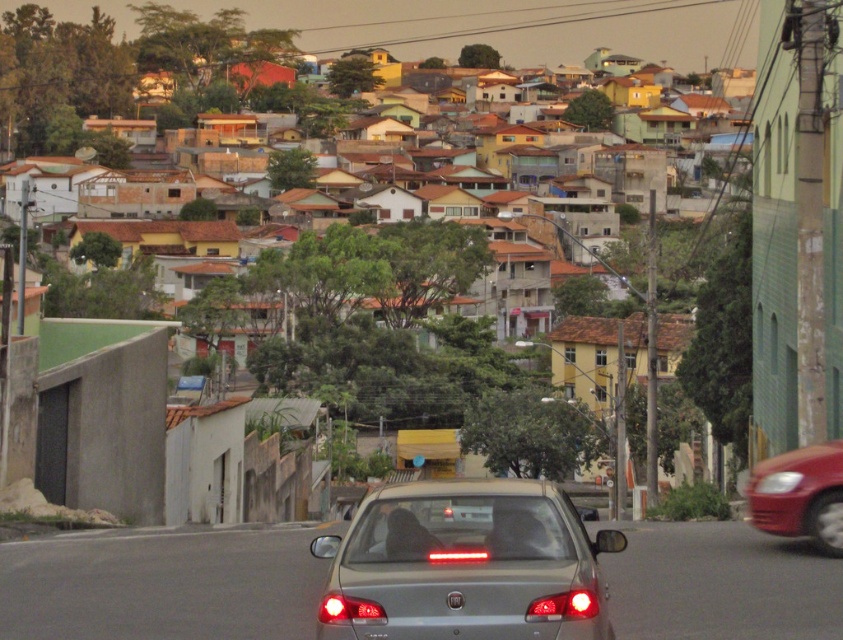
In the scene shown: You are standing at the point with coordinates point [772,461] and want to walk to the point with coordinates point [74,58]. Which direction should you face to move towards your destination?

Answer: You should face downward because point [74,58] is behind point [772,461].

You are a pedestrian standing at the crosswalk and see the satin silver sedan at center and the shiny red car at right. Which car is positioned higher in the image?

The satin silver sedan at center is located above the shiny red car at right, so it is positioned higher in the image.

You are a delivery driver who needs to park your vehicle in a tight space between two cars. You see a satin silver sedan at center and a shiny red car at right. Which car should you avoid parking next to if you want to leave more space for your delivery van?

The shiny red car at right is longer than the satin silver sedan at center, so parking next to the shiny red car at right would leave less space for your delivery van. Avoid parking next to the shiny red car at right.